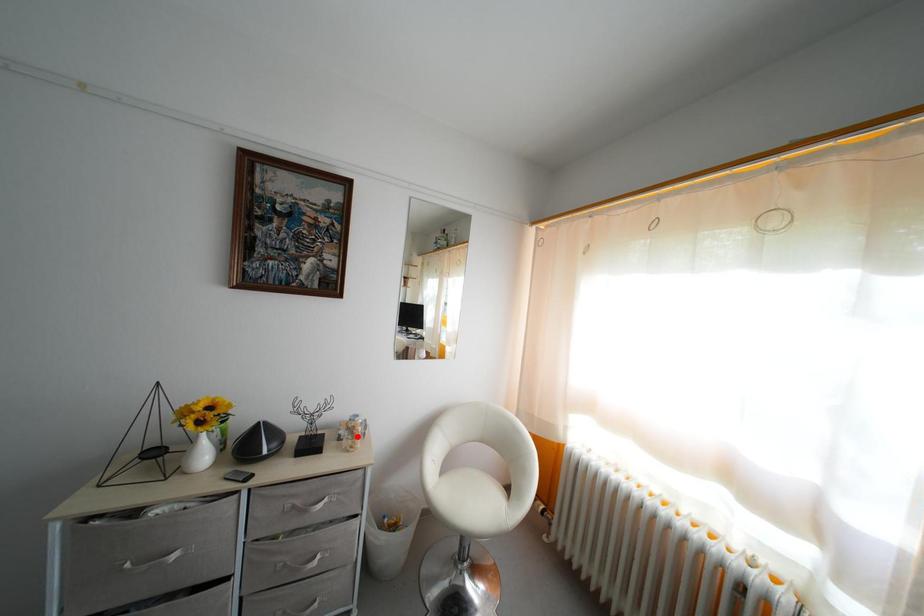
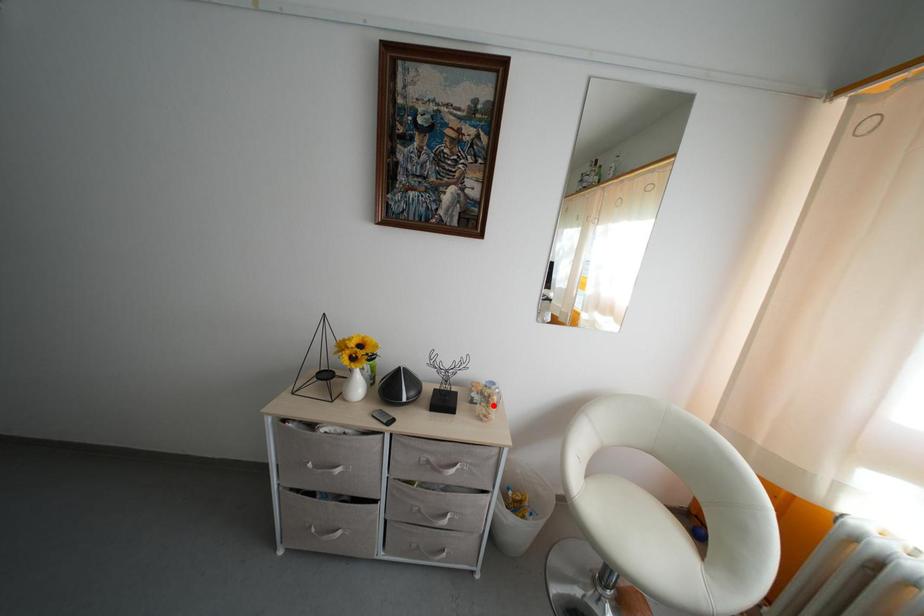
I am providing you with two images of the same scene from different viewpoints. A red point is marked on the first image and another point is marked on the second image. Is the red point in image1 aligned with the point shown in image2?

Yes